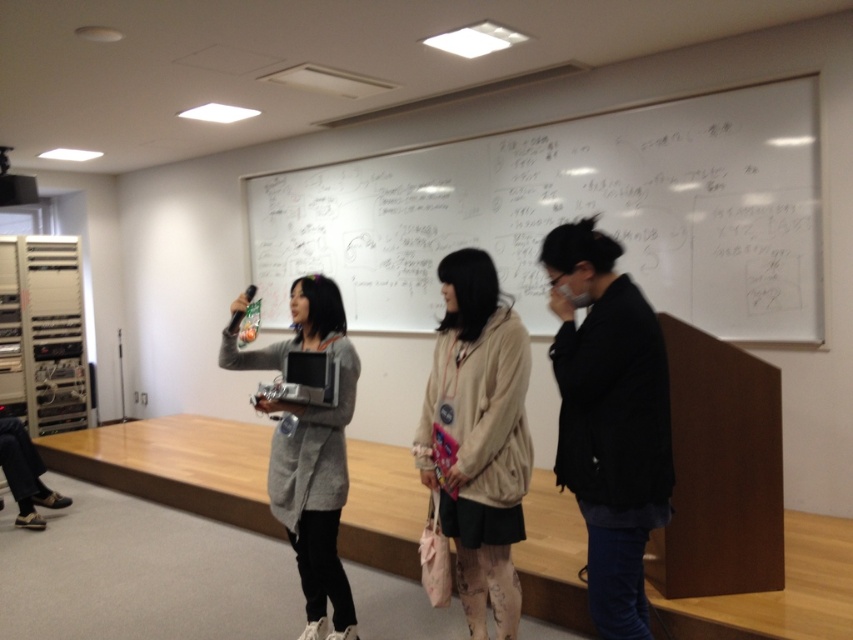
Is black matte jacket at center below beige fabric jacket at center?

Incorrect, black matte jacket at center is not positioned below beige fabric jacket at center.

The width and height of the screenshot is (853, 640). Describe the element at coordinates (608, 419) in the screenshot. I see `black matte jacket at center` at that location.

Is point (564, 312) farther from viewer compared to point (436, 330)?

No, (564, 312) is closer to viewer.

At what (x,y) coordinates should I click in order to perform the action: click on black matte jacket at center. Please return your answer as a coordinate pair (x, y). Looking at the image, I should click on pos(608,419).

Does point (462, 412) lie behind point (325, 616)?

That is False.

Does beige fabric jacket at center appear on the right side of gray matte cardigan at center?

Indeed, beige fabric jacket at center is positioned on the right side of gray matte cardigan at center.

Who is more distant from viewer, (489, 282) or (323, 566)?

Positioned behind is point (323, 566).

The width and height of the screenshot is (853, 640). Identify the location of beige fabric jacket at center. 479,436.

Is black matte jacket at center taller than gray matte cardigan at center?

No.

Identify the location of black matte jacket at center. This screenshot has width=853, height=640. (608, 419).

Image resolution: width=853 pixels, height=640 pixels. I want to click on black matte jacket at center, so click(608, 419).